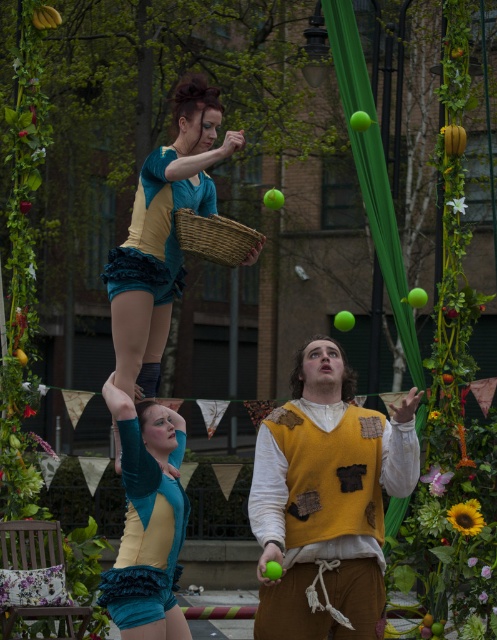
Question: Estimate the real-world distances between objects in this image. Which object is farther from the teal velvet shorts at lower left?

Choices:
 (A) matte yellow vest at center
 (B) teal ruffled shorts at upper center

Answer: (B)

Question: Which object is positioned farthest from the teal velvet shorts at lower left?

Choices:
 (A) teal fabric shorts at upper center
 (B) woven brown basket at center
 (C) teal ruffled shorts at upper center
 (D) matte yellow vest at center

Answer: (B)

Question: Can you confirm if matte yellow vest at center is positioned to the right of woven brown basket at center?

Choices:
 (A) no
 (B) yes

Answer: (B)

Question: In this image, where is matte yellow vest at center located relative to teal ruffled shorts at upper center?

Choices:
 (A) below
 (B) above

Answer: (A)

Question: Which point is farther to the camera?

Choices:
 (A) (238, 228)
 (B) (165, 296)

Answer: (B)

Question: Can you confirm if matte yellow vest at center is positioned below woven brown basket at center?

Choices:
 (A) no
 (B) yes

Answer: (B)